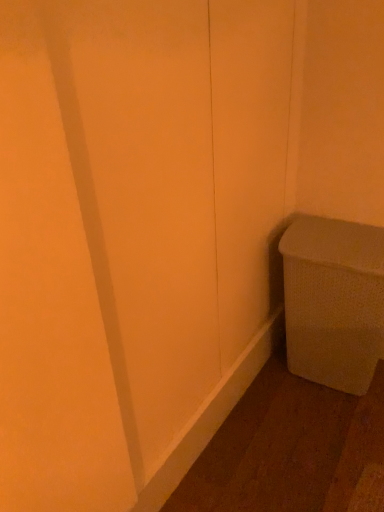
Identify the location of white textured basket at lower right. (334, 301).

This screenshot has height=512, width=384. What do you see at coordinates (334, 301) in the screenshot?
I see `white textured basket at lower right` at bounding box center [334, 301].

You are a GUI agent. You are given a task and a screenshot of the screen. Output one action in this format:
    pyautogui.click(x=<x>, y=<y>)
    Task: Click on the white textured basket at lower right
    The image size is (384, 512).
    Given the screenshot: What is the action you would take?
    pyautogui.click(x=334, y=301)